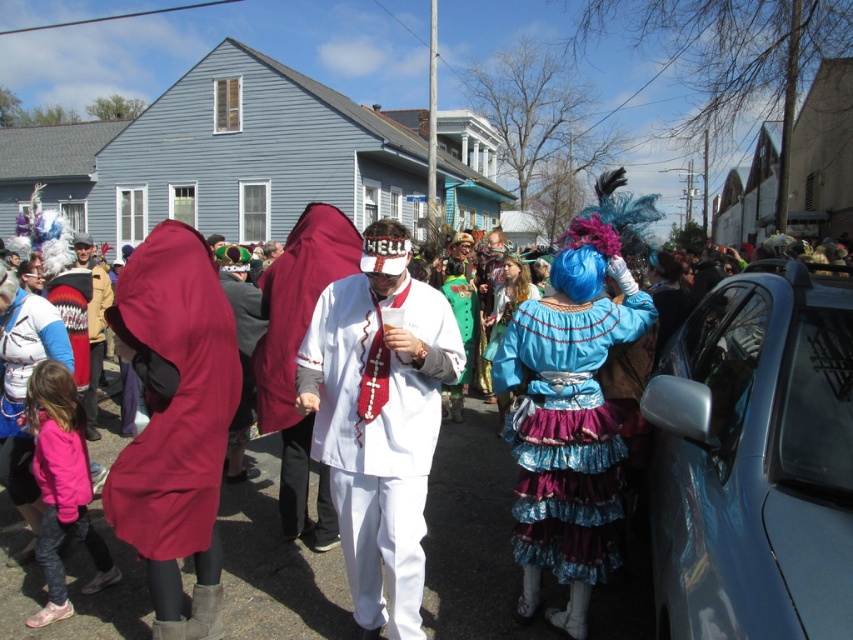
You are a photographer trying to capture the white matte suit at center without the blue metallic car at right blocking the view. Is the car currently blocking the suit?

The blue metallic car at right is in front of the white matte suit at center, so yes, the car is blocking the view of the suit.

You are standing at the point marked by the coordinates point (379, 420) in the image. Looking around, you see the white matte suit at center. Which direction should you face to see the white matte suit at center?

You are already at the point marked by the coordinates point (379, 420), which indicates the location of the white matte suit at center. Therefore, you are facing the white matte suit at center directly.